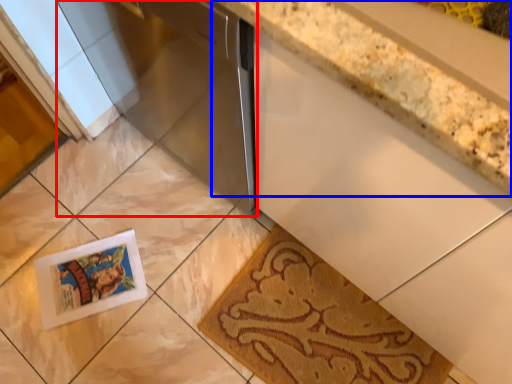
Question: Which point is closer to the camera, appliance (highlighted by a red box) or countertop (highlighted by a blue box)?

Choices:
 (A) appliance
 (B) countertop

Answer: (B)